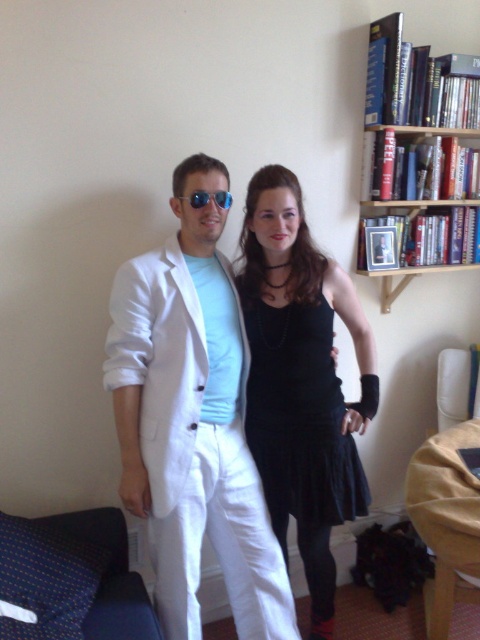
You are a fashion designer observing the scene. You need to determine which item has a greater width between the white matte suit at center and the sunglasses at center. Which one is wider?

The white matte suit at center is wider than the sunglasses at center according to the description.

You are a photographer setting up for a photoshoot in the living room. You need to position a light source to the right of the white matte suit at center and to the left of the black satin dress at center. Is this possible given their positions?

The white matte suit at center is to the left of the black satin dress at center, so placing the light source to the right of the white matte suit at center and to the left of the black satin dress at center is possible as they are positioned in a line from left to right.

You are a photographer setting up a shoot in the living room. You need to position a light source to the right of the white matte suit at center and to the left of the sunglasses at center. Is this possible based on their current positions?

The white matte suit at center is to the left of the sunglasses at center, so placing a light source to the right of the white matte suit at center and to the left of the sunglasses at center is possible as the light can be positioned between them.